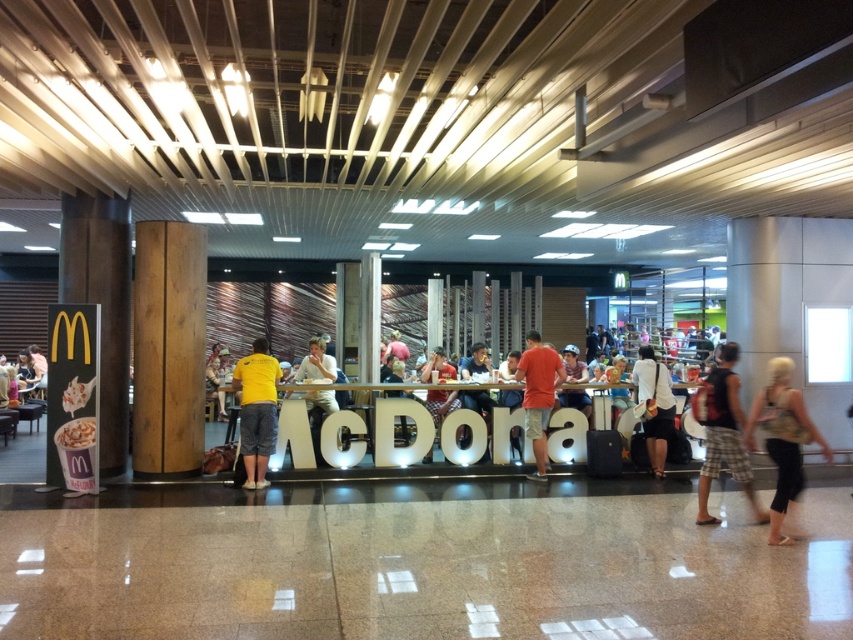
Question: Is white fabric bag at center to the left of matte white shirt at center from the viewer's perspective?

Choices:
 (A) no
 (B) yes

Answer: (A)

Question: Which of these objects is positioned farthest from the camouflage shorts at right?

Choices:
 (A) matte orange t-shirt at center
 (B) black leather pants at lower right

Answer: (A)

Question: Which of the following is the farthest from the observer?

Choices:
 (A) camouflage shorts at right
 (B) matte white shirt at center
 (C) matte orange t-shirt at center
 (D) black leather pants at lower right

Answer: (B)

Question: Is yellow fabric shirt at center positioned at the back of white fabric bag at center?

Choices:
 (A) no
 (B) yes

Answer: (A)

Question: Among these points, which one is farthest from the camera?

Choices:
 (A) (728, 356)
 (B) (250, 456)

Answer: (B)

Question: Does matte orange t-shirt at center have a smaller size compared to white fabric bag at center?

Choices:
 (A) no
 (B) yes

Answer: (B)